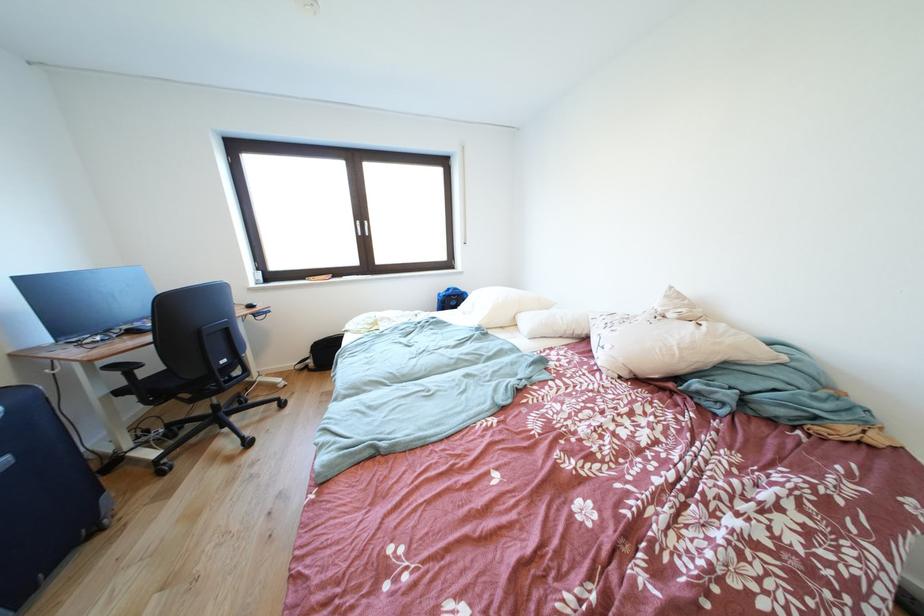
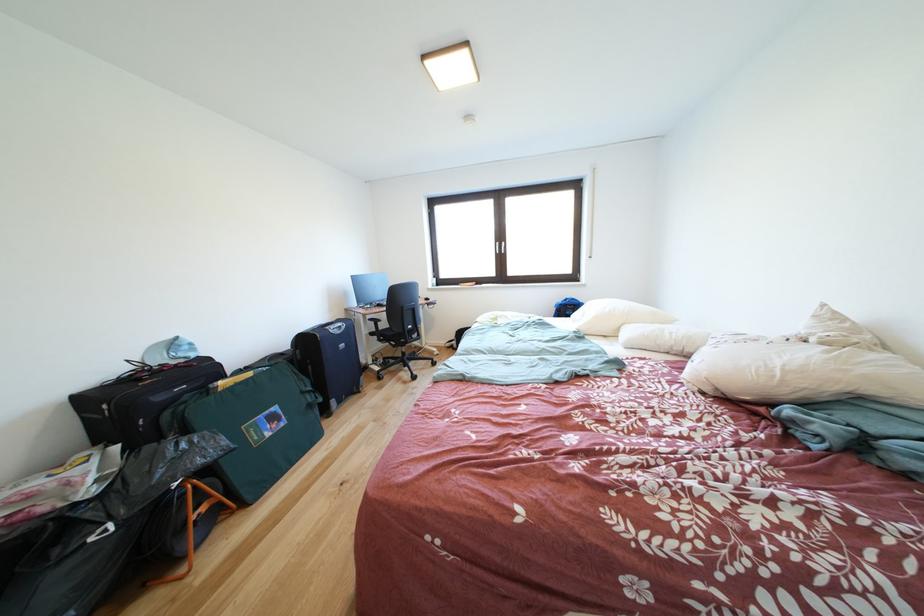
Locate, in the second image, the point that corresponds to the point at 463,300 in the first image.

(578, 310)